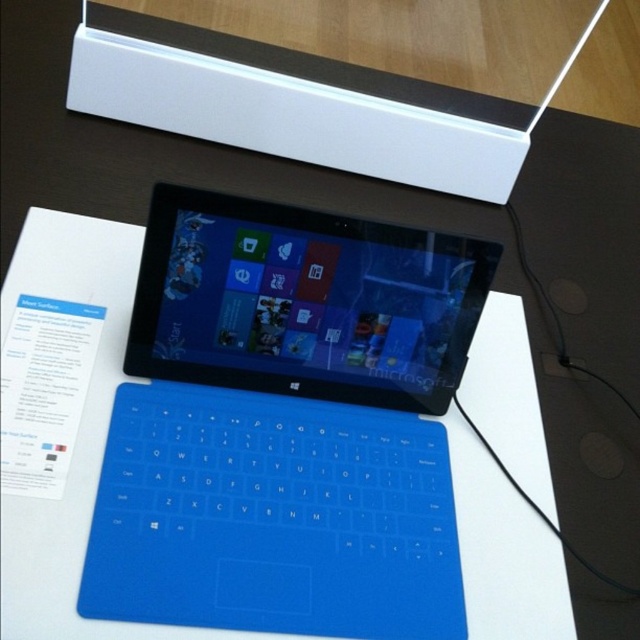
Question: Does blue matte keyboard at center come behind white plastic box at upper center?

Choices:
 (A) no
 (B) yes

Answer: (A)

Question: Does blue matte keyboard at center have a greater width compared to white plastic box at upper center?

Choices:
 (A) yes
 (B) no

Answer: (B)

Question: Which object is closer to the camera taking this photo?

Choices:
 (A) blue matte keyboard at center
 (B) white plastic box at upper center

Answer: (A)

Question: Does blue matte keyboard at center have a larger size compared to white plastic box at upper center?

Choices:
 (A) no
 (B) yes

Answer: (B)

Question: Among these objects, which one is nearest to the camera?

Choices:
 (A) blue matte keyboard at center
 (B) white plastic box at upper center

Answer: (A)